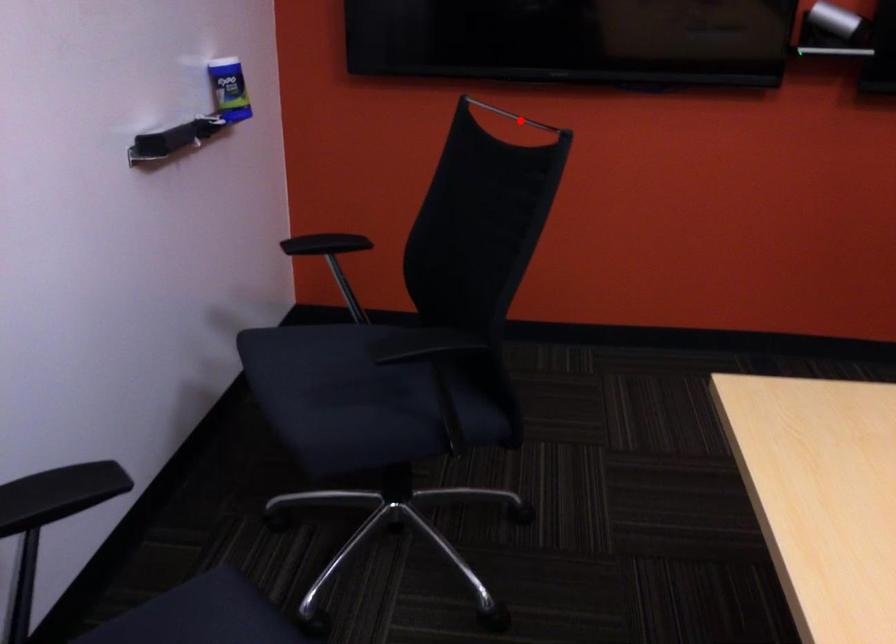
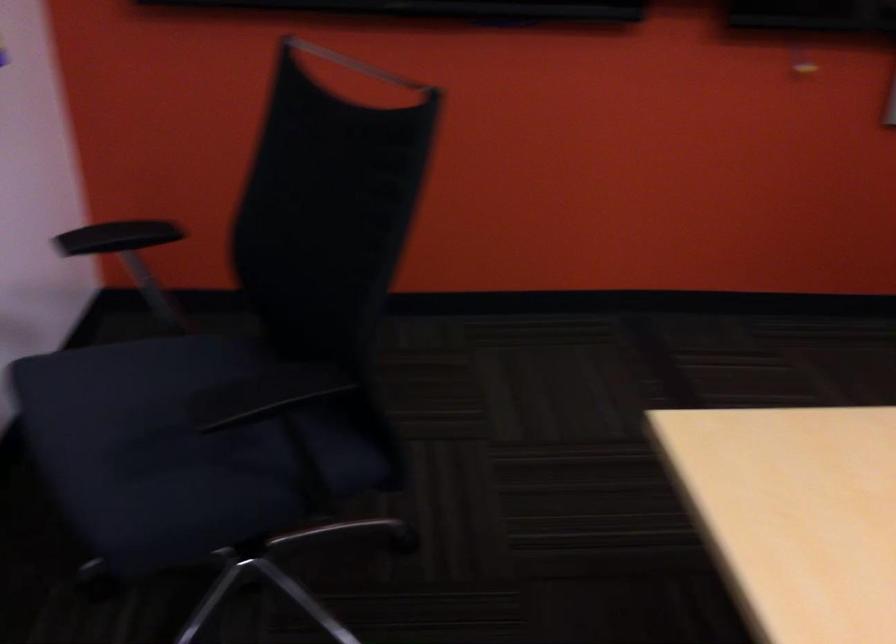
The point at the highlighted location is marked in the first image. Where is the corresponding point in the second image?

(356, 64)